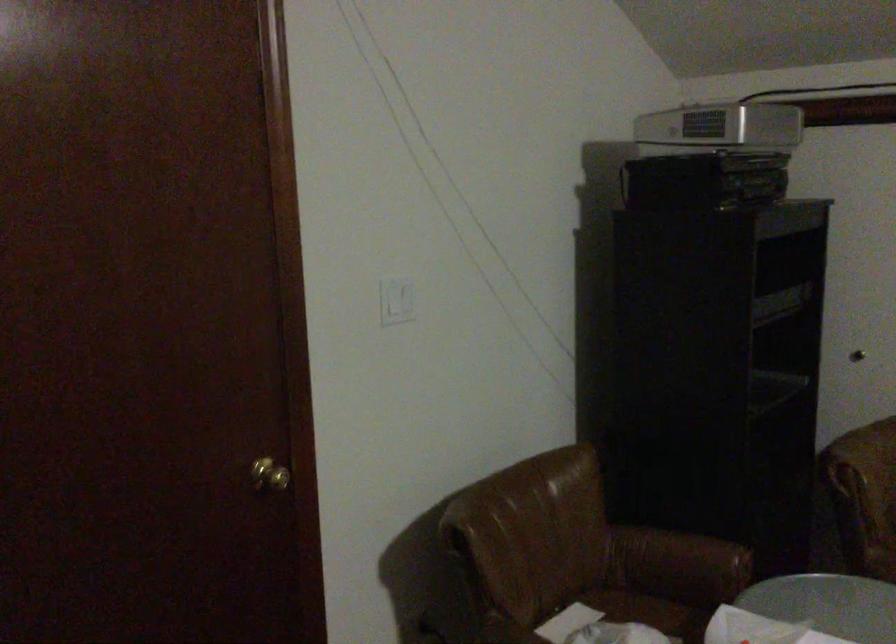
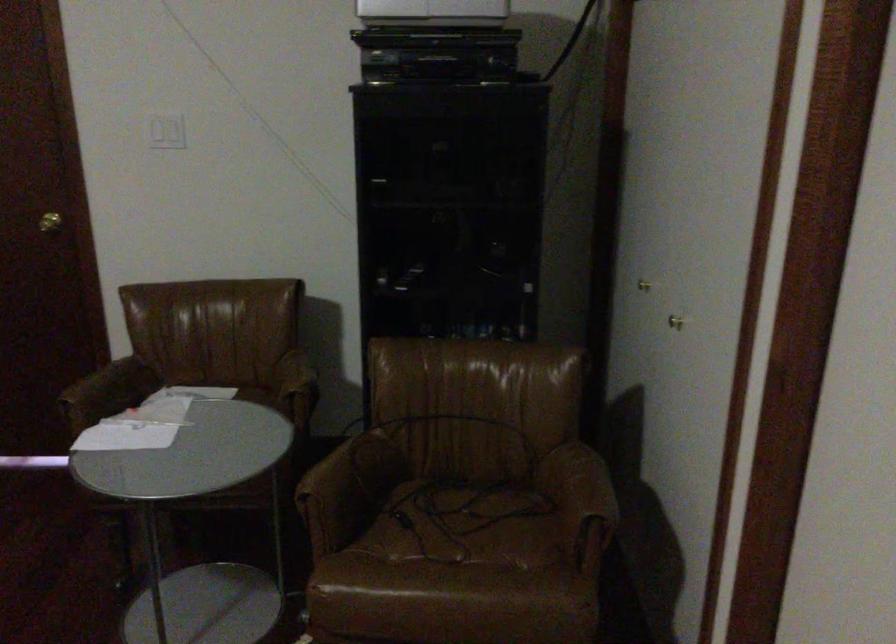
Locate, in the second image, the point that corresponds to [304,484] in the first image.

(49, 222)